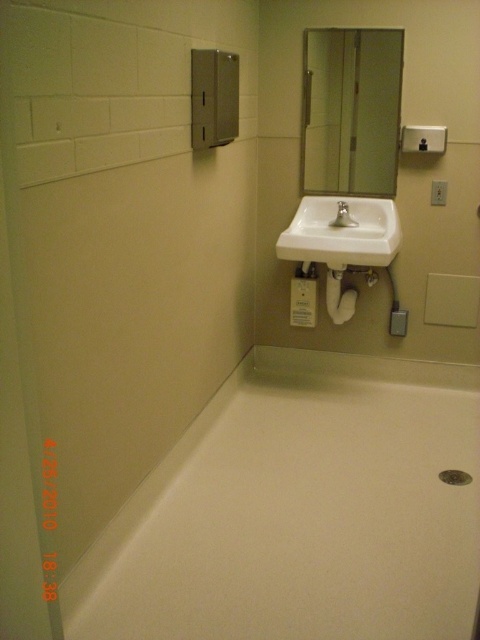
Who is lower down, white smooth bathtub at lower center or matte silver faucet at center?

Positioned lower is white smooth bathtub at lower center.

This screenshot has width=480, height=640. Find the location of `white smooth bathtub at lower center`. white smooth bathtub at lower center is located at coordinates (300, 509).

The height and width of the screenshot is (640, 480). What are the coordinates of `white smooth bathtub at lower center` in the screenshot? It's located at (300, 509).

Measure the distance between white smooth bathtub at lower center and clear glass mirror at upper center.

They are 1.42 meters apart.

Can you confirm if white smooth bathtub at lower center is taller than clear glass mirror at upper center?

Incorrect, white smooth bathtub at lower center's height is not larger of clear glass mirror at upper center's.

Is point (363, 429) positioned after point (350, 115)?

No, it is in front of (350, 115).

Where is `white smooth bathtub at lower center`? white smooth bathtub at lower center is located at coordinates (300, 509).

Does clear glass mirror at upper center appear over matte silver faucet at center?

Yes, clear glass mirror at upper center is above matte silver faucet at center.

Who is positioned more to the left, clear glass mirror at upper center or matte silver faucet at center?

matte silver faucet at center is more to the left.

Who is more forward, (358, 170) or (339, 218)?

Point (339, 218) is in front.

The width and height of the screenshot is (480, 640). In order to click on clear glass mirror at upper center in this screenshot , I will do `click(350, 109)`.